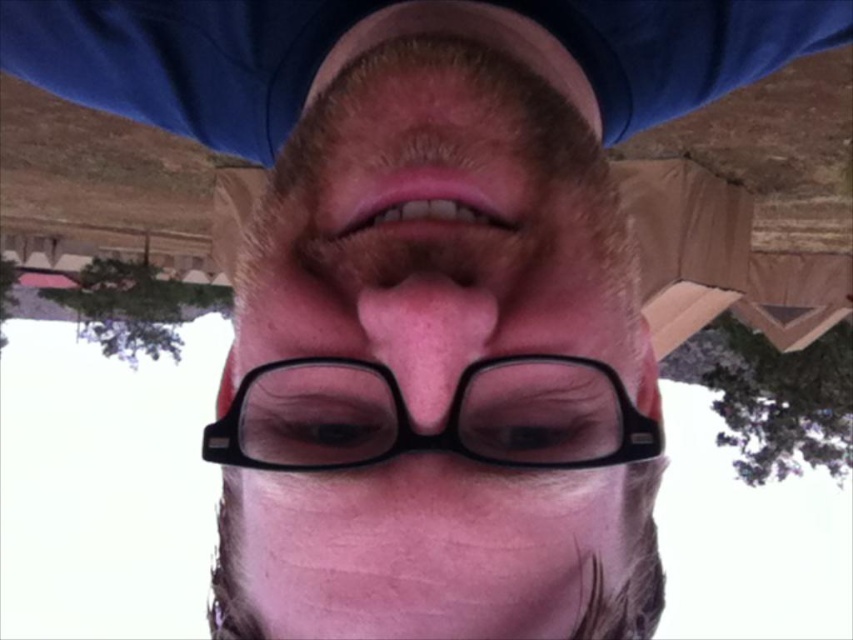
Can you confirm if clear plastic eye at center is taller than black matte eye at center?

Incorrect, clear plastic eye at center's height is not larger of black matte eye at center's.

This screenshot has width=853, height=640. Find the location of `clear plastic eye at center`. clear plastic eye at center is located at coordinates (538, 429).

Consider the image. Who is taller, black matte glasses at center or pink matte nose at center?

Standing taller between the two is black matte glasses at center.

Who is more distant from viewer, [538,390] or [373,300]?

The point [538,390] is more distant.

Is point (480, 45) positioned before point (421, 410)?

No, (480, 45) is behind (421, 410).

You are a GUI agent. You are given a task and a screenshot of the screen. Output one action in this format:
    pyautogui.click(x=<x>, y=<y>)
    Task: Click on the black matte glasses at center
    Image resolution: width=853 pixels, height=640 pixels.
    Given the screenshot: What is the action you would take?
    pyautogui.click(x=438, y=364)

In the scene shown: Can you confirm if pink matte lips at center is thinner than clear plastic eye at center?

In fact, pink matte lips at center might be wider than clear plastic eye at center.

Who is more distant from viewer, (502, 204) or (546, 401)?

The point (502, 204) is more distant.

Based on the photo, who is more forward, (451, 180) or (502, 440)?

Point (502, 440)

This screenshot has height=640, width=853. Identify the location of pink matte lips at center. (422, 204).